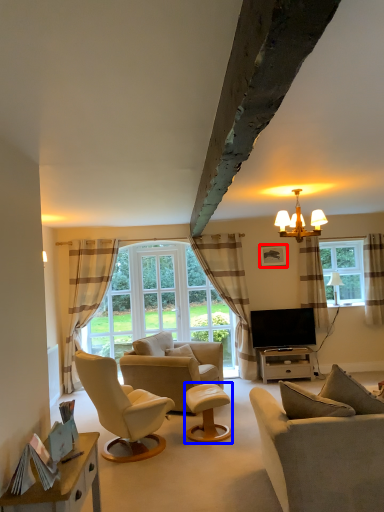
Question: Among these objects, which one is nearest to the camera, picture frame (highlighted by a red box) or stool (highlighted by a blue box)?

Choices:
 (A) picture frame
 (B) stool

Answer: (B)